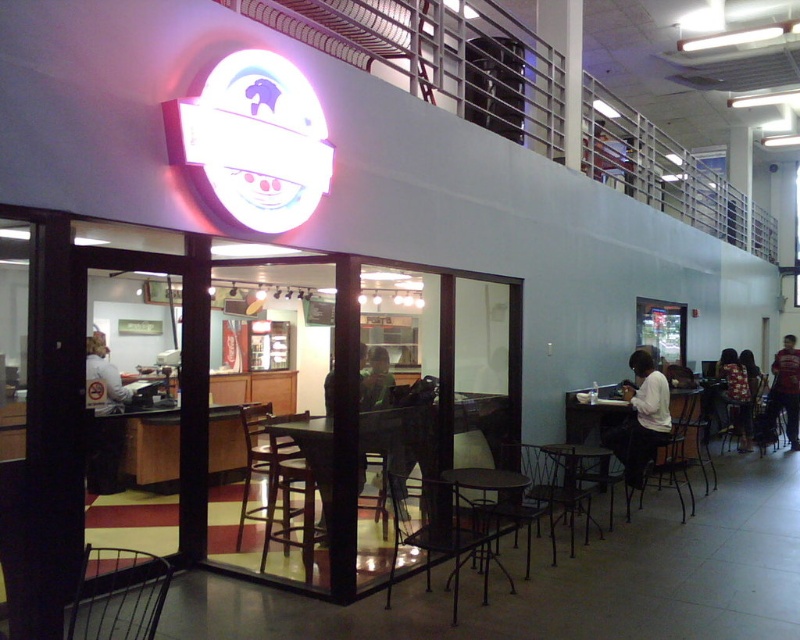
Question: Which point is closer to the camera?

Choices:
 (A) wooden table at center
 (B) white matte shirt at lower right

Answer: (A)

Question: Which point appears farthest from the camera in this image?

Choices:
 (A) (492, 481)
 (B) (80, 600)
 (C) (242, 509)

Answer: (C)

Question: Which of the following is the closest to the observer?

Choices:
 (A) metallic dark brown chair at lower center
 (B) metallic wire chair at lower left
 (C) metallic black chair at lower right

Answer: (B)

Question: Can you confirm if metallic black chair at lower center is smaller than floral shirt at lower right?

Choices:
 (A) yes
 (B) no

Answer: (B)

Question: Can you confirm if wooden table at center is positioned below metallic wire chair at lower left?

Choices:
 (A) yes
 (B) no

Answer: (B)

Question: In this image, where is metallic wire chair at lower left located relative to metallic black stool at lower center?

Choices:
 (A) right
 (B) left

Answer: (B)